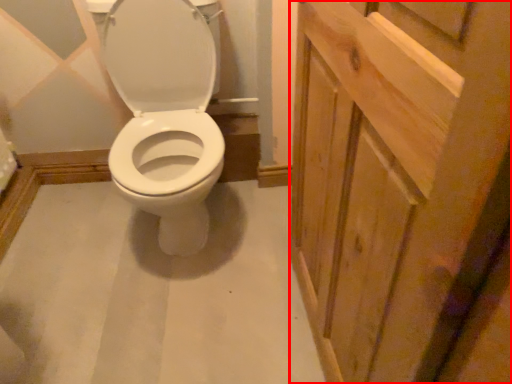
Question: From the image's perspective, where is screen door (annotated by the red box) located in relation to sit in the image?

Choices:
 (A) below
 (B) above

Answer: (A)